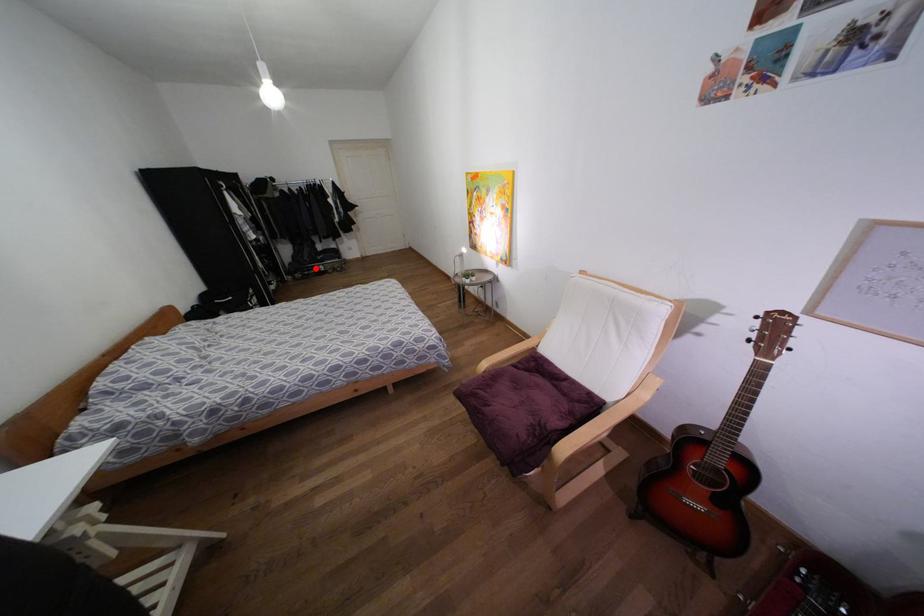
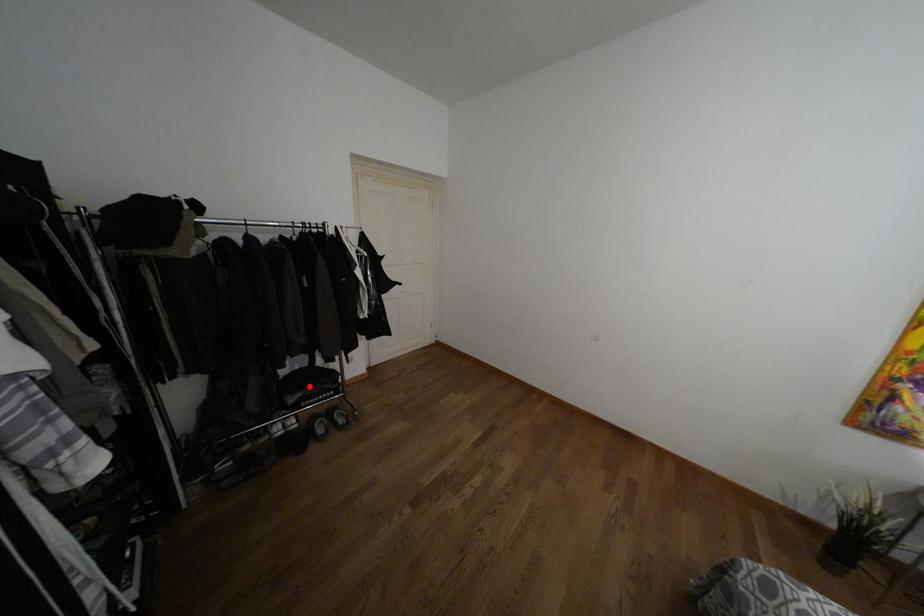
I am providing you with two images of the same scene from different viewpoints. A red point is marked on the first image and another point is marked on the second image. Does the point marked in image1 correspond to the same location as the one in image2?

No